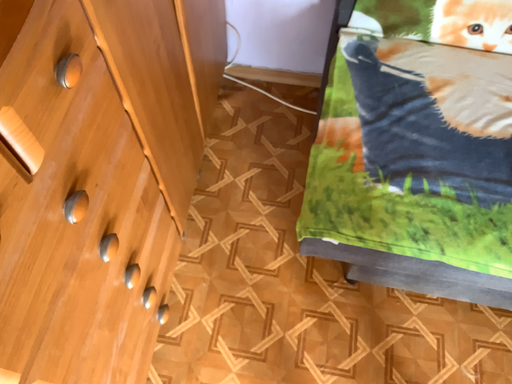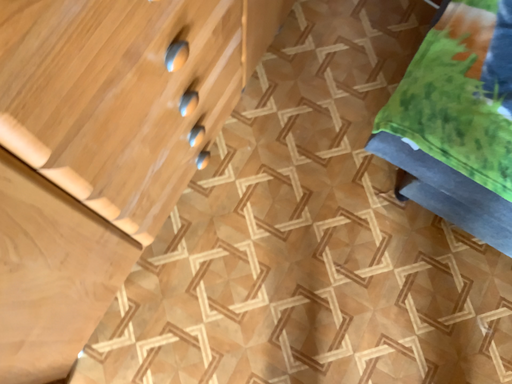
Question: Which way did the camera rotate in the video?

Choices:
 (A) rotated right
 (B) rotated left

Answer: (B)